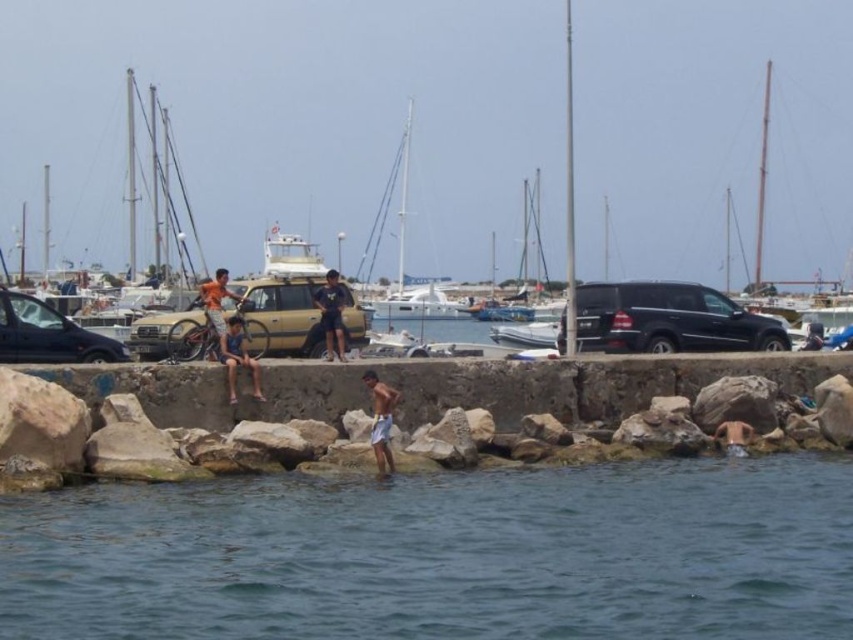
Question: Can you confirm if blue water at lower center is thinner than matte black van at left?

Choices:
 (A) no
 (B) yes

Answer: (A)

Question: Among these points, which one is nearest to the camera?

Choices:
 (A) (84, 356)
 (B) (233, 332)
 (C) (689, 314)

Answer: (B)

Question: Which point is closer to the camera?

Choices:
 (A) (393, 186)
 (B) (376, 413)

Answer: (B)

Question: Does white glossy boat at center come behind white cotton shorts at lower center?

Choices:
 (A) yes
 (B) no

Answer: (A)

Question: Which point is farther from the camera taking this photo?

Choices:
 (A) (370, 232)
 (B) (378, 400)

Answer: (A)

Question: Is white glossy sailboat at center above white glossy boat at center?

Choices:
 (A) yes
 (B) no

Answer: (A)